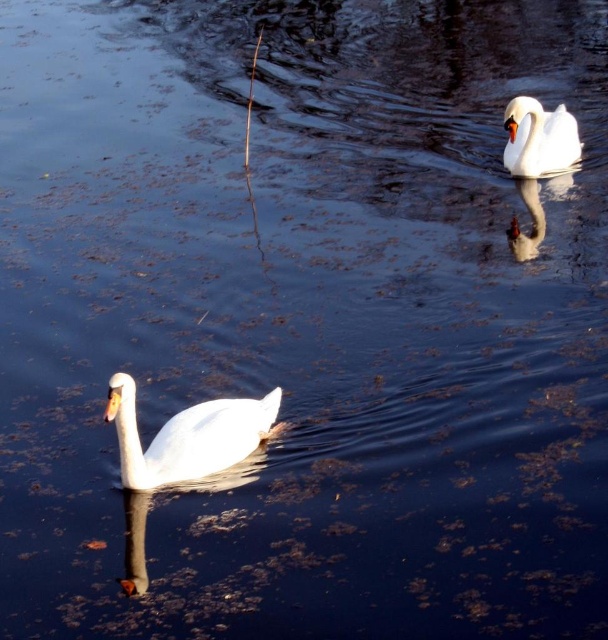
You are a photographer trying to capture both swans in a single shot. Since the white glossy swan at lower left and the white glossy swan at upper right are both white, how can you distinguish them in your photo?

The white glossy swan at lower left is positioned on the left side of the white glossy swan at upper right, so you can distinguish them by their relative positions in the frame.

You are standing on the edge of the water and see the white glossy swan at lower left. If you want to throw a small pebble to reach the swan, what is the minimum distance you need to throw it?

The minimum distance you need to throw the pebble to reach the white glossy swan at lower left is 4.13 meters, as that is the distance between you and the swan.

You are standing at the edge of the water and want to throw a small pebble to hit the white glossy swan at lower left. Based on the coordinates provided, in which direction should you aim relative to your position?

The white glossy swan at lower left is located at point (188, 435), which means you should aim slightly to the right and downward from your position at the edge to hit it.